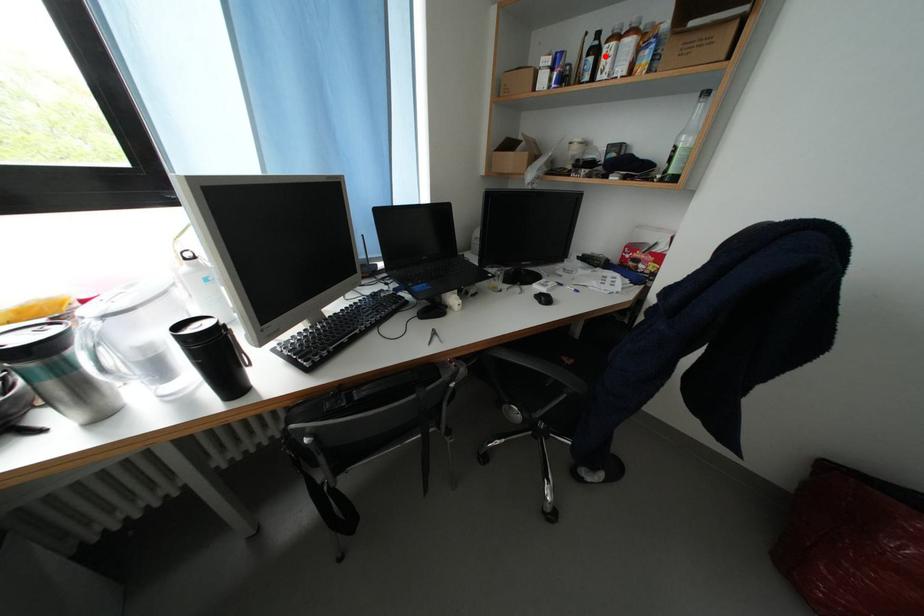
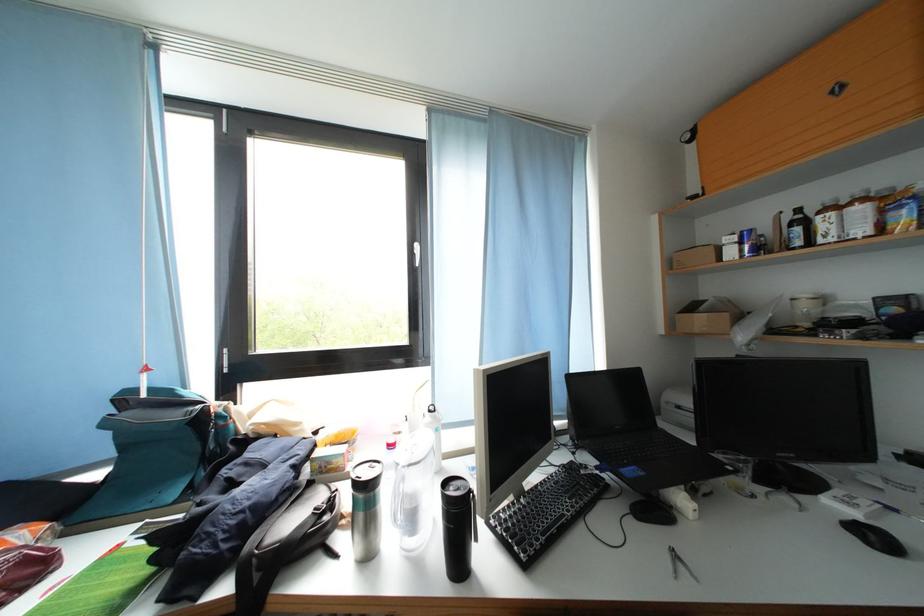
The point at the highlighted location is marked in the first image. Where is the corresponding point in the second image?

(812, 227)